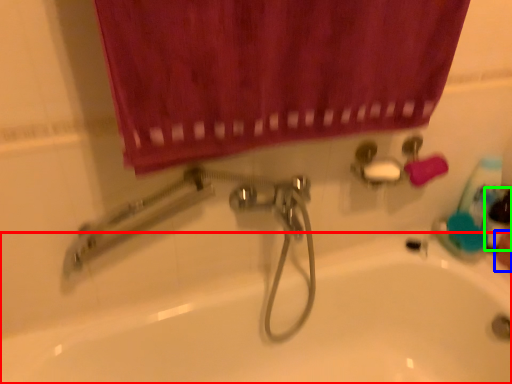
Question: Which object is the farthest from bath (highlighted by a red box)? Choose among these: hand (highlighted by a blue box) or mouthwash (highlighted by a green box).

Choices:
 (A) hand
 (B) mouthwash

Answer: (A)